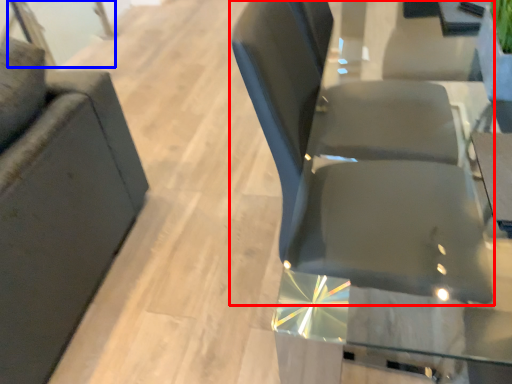
Question: Which object is further to the camera taking this photo, chair (highlighted by a red box) or glass door (highlighted by a blue box)?

Choices:
 (A) chair
 (B) glass door

Answer: (B)